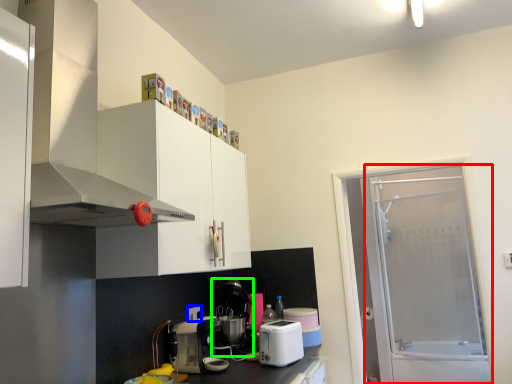
Question: Considering the real-world distances, which object is closest to screen door (highlighted by a red box)? electric outlet (highlighted by a blue box) or coffee machine (highlighted by a green box).

Choices:
 (A) electric outlet
 (B) coffee machine

Answer: (B)